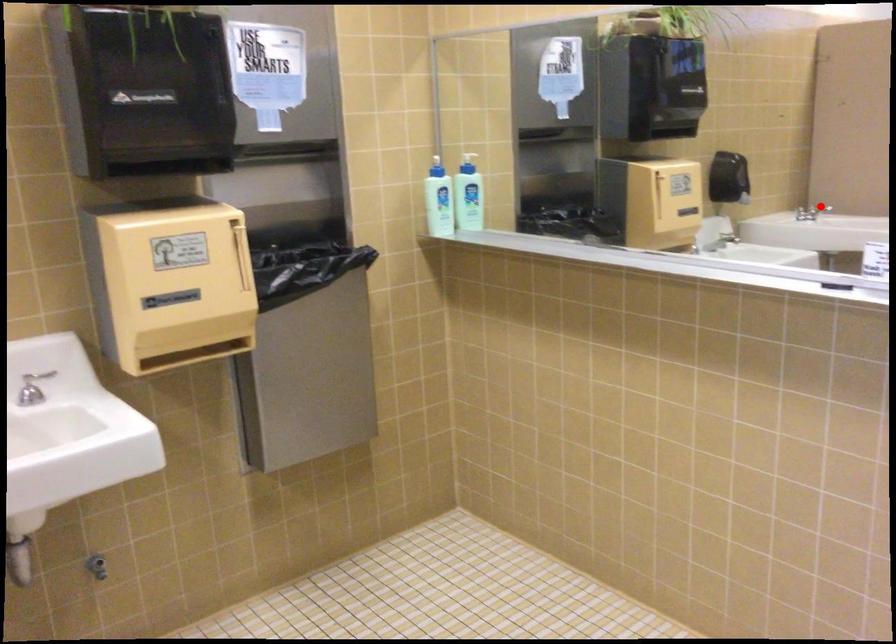
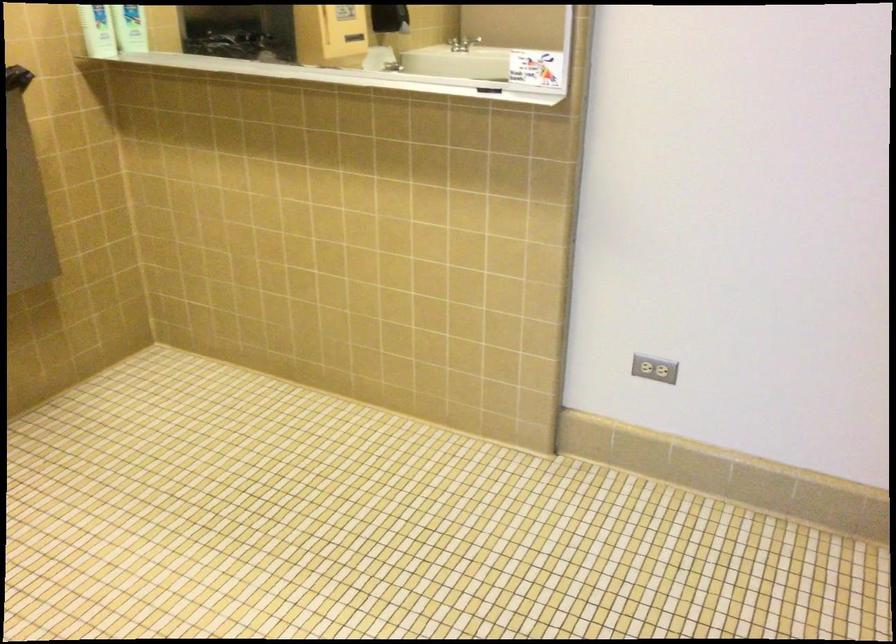
The point at the highlighted location is marked in the first image. Where is the corresponding point in the second image?

(469, 43)